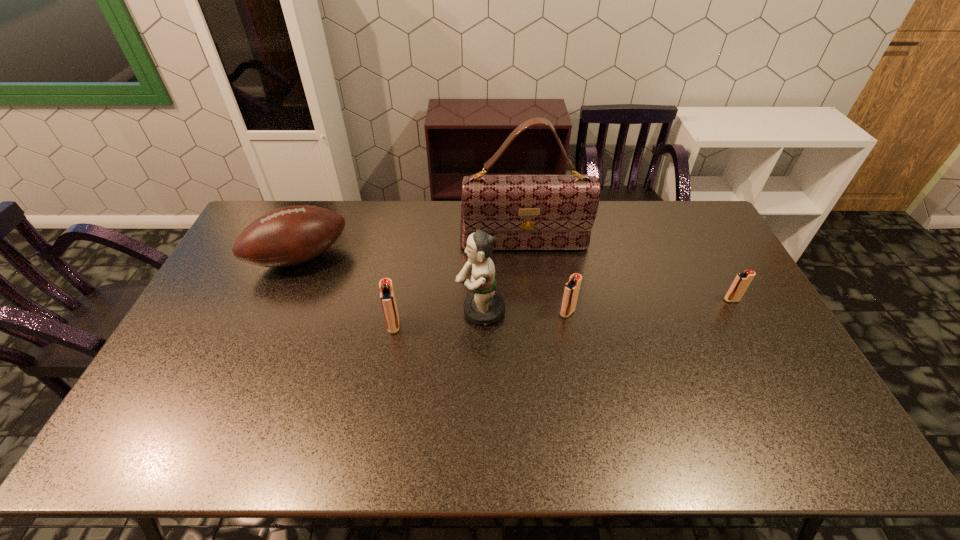
Locate an element on the screen. vacant space that's between the tallest object and the football (American) is located at coordinates (412, 252).

Choose which object is the nearest neighbor to the leftmost igniter. Please provide its 2D coordinates. Your answer should be formatted as a tuple, i.e. [(x, y)], where the tuple contains the x and y coordinates of a point satisfying the conditions above.

[(484, 306)]

Image resolution: width=960 pixels, height=540 pixels. I want to click on the second closest object relative to the fifth shortest object, so click(387, 296).

Image resolution: width=960 pixels, height=540 pixels. I want to click on igniter identified as the second closest to the leftmost object, so click(571, 290).

Select which igniter is the third closest to the tallest object. Please provide its 2D coordinates. Your answer should be formatted as a tuple, i.e. [(x, y)], where the tuple contains the x and y coordinates of a point satisfying the conditions above.

[(741, 282)]

Image resolution: width=960 pixels, height=540 pixels. Find the location of `free space that satisfies the following two spatial constraints: 1. on the front side of the football (American); 2. on the left side of the farthest igniter`. free space that satisfies the following two spatial constraints: 1. on the front side of the football (American); 2. on the left side of the farthest igniter is located at coordinates (281, 300).

In order to click on free space in the image that satisfies the following two spatial constraints: 1. on the front of the second shortest igniter with the clasp; 2. on the left side of the tallest object in this screenshot , I will do `click(532, 313)`.

What are the coordinates of `free space that satisfies the following two spatial constraints: 1. on the front of the handbag with the clasp; 2. on the front-facing side of the figurine` in the screenshot? It's located at (531, 310).

I want to click on vacant area in the image that satisfies the following two spatial constraints: 1. on the front of the fifth tallest object with the clasp; 2. on the right side of the tallest object, so click(x=532, y=313).

Identify the location of free space in the image that satisfies the following two spatial constraints: 1. on the front side of the rightmost object; 2. on the right side of the leftmost object. This screenshot has width=960, height=540. (281, 300).